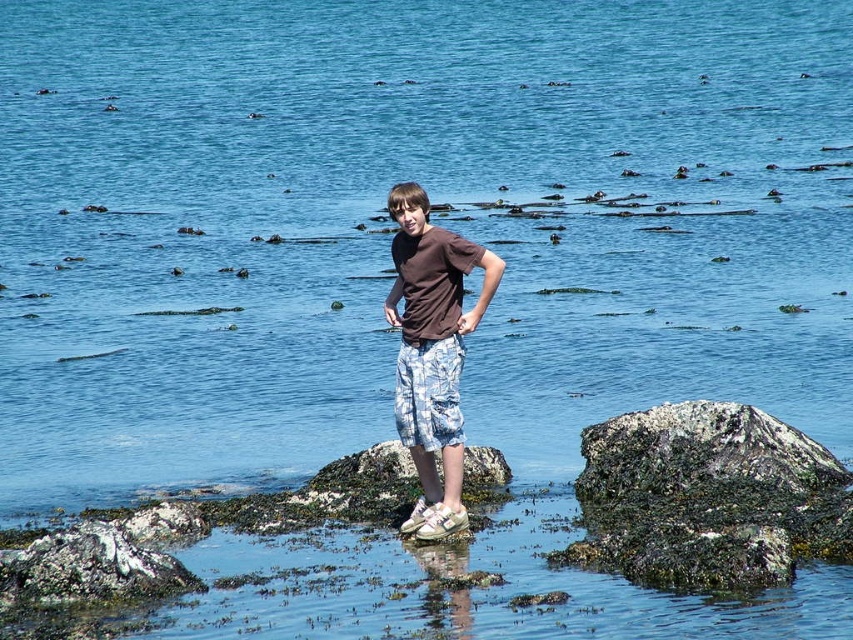
Question: In this image, where is green mossy rock at lower right located relative to brown cotton shirt at center?

Choices:
 (A) right
 (B) left

Answer: (A)

Question: Considering the real-world distances, which object is closest to the brown cotton shirt at center?

Choices:
 (A) green mossy rock at lower right
 (B) blue camouflage shorts at center

Answer: (B)

Question: Does green mossy rock at lower right come behind blue camouflage shorts at center?

Choices:
 (A) yes
 (B) no

Answer: (B)

Question: Which object appears farthest from the camera in this image?

Choices:
 (A) blue camouflage shorts at center
 (B) green mossy rock at lower right

Answer: (A)

Question: Which point is closer to the camera taking this photo?

Choices:
 (A) (405, 257)
 (B) (436, 387)

Answer: (B)

Question: Does green mossy rock at lower right have a greater width compared to blue camouflage shorts at center?

Choices:
 (A) no
 (B) yes

Answer: (B)